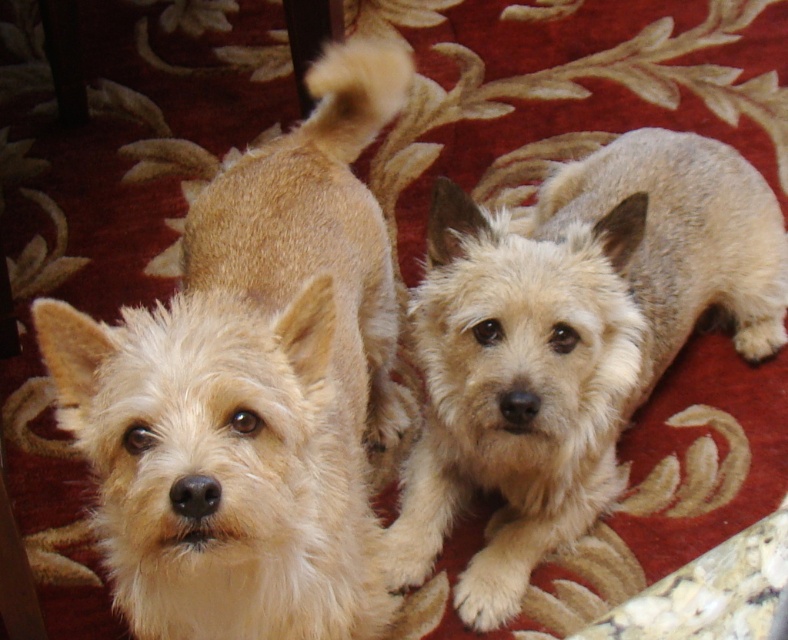
Who is positioned more to the right, light beige fur at center or fuzzy beige dog at center?

→ Positioned to the right is fuzzy beige dog at center.

Who is shorter, light beige fur at center or fuzzy beige dog at center?

fuzzy beige dog at center is shorter.

Which is in front, point (311, 316) or point (424, 525)?

Point (311, 316) is in front.

Identify the location of light beige fur at center. (251, 388).